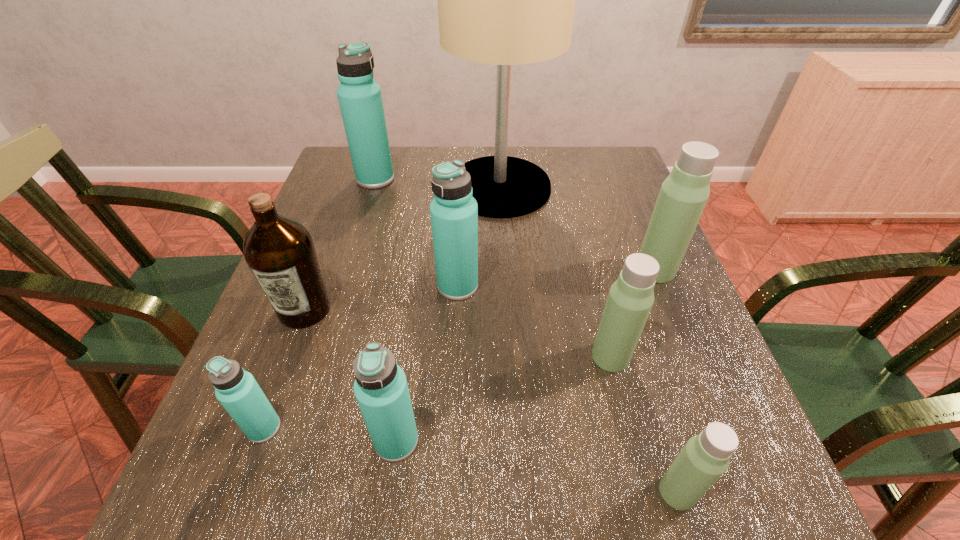
Identify the location of the second smallest aqua thermos bottle. The height and width of the screenshot is (540, 960). (380, 387).

Where is `the second farthest light thermos bottle`? the second farthest light thermos bottle is located at coordinates pos(631,297).

What are the coordinates of `the sixth farthest object` in the screenshot? It's located at (631, 297).

Find the location of a particular element. Image resolution: width=960 pixels, height=540 pixels. the smallest aqua thermos bottle is located at coordinates (237, 390).

Locate an element on the screen. the nearest light thermos bottle is located at coordinates click(705, 457).

At what (x,y) coordinates should I click in order to perform the action: click on the nearest object. Please return your answer as a coordinate pair (x, y). This screenshot has width=960, height=540. Looking at the image, I should click on (705, 457).

This screenshot has width=960, height=540. Find the location of `free space located on the front of the beige table lamp`. free space located on the front of the beige table lamp is located at coordinates (502, 239).

Image resolution: width=960 pixels, height=540 pixels. Identify the location of vacant space located on the right of the farthest thermos bottle. (461, 179).

The height and width of the screenshot is (540, 960). What are the coordinates of `vacant space positioned on the front of the farthest light thermos bottle` in the screenshot? It's located at (671, 307).

This screenshot has height=540, width=960. Identify the location of free space located on the left of the third smallest aqua thermos bottle. (323, 286).